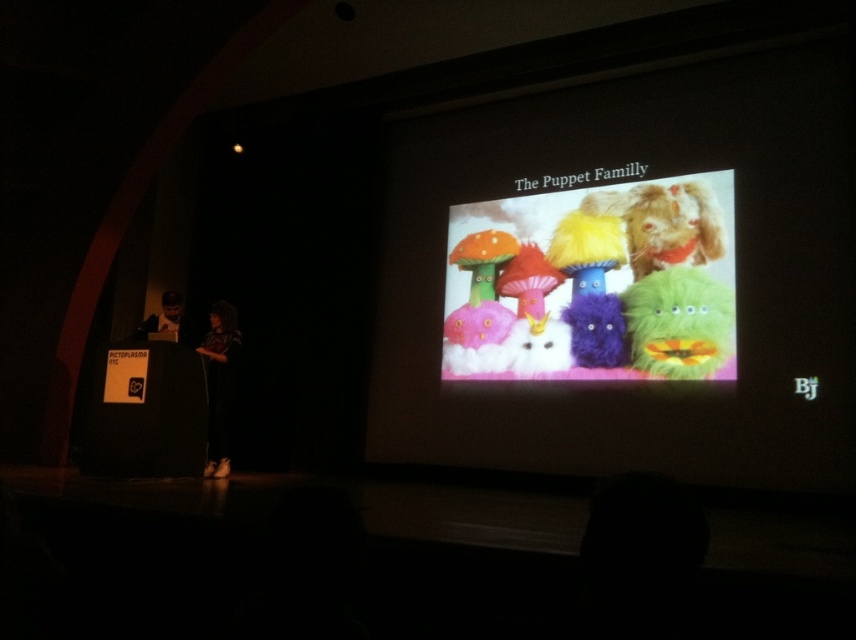
You are an attendee at the PICTORPLASMA NYC event and you see the fuzzy fabric puppets at center and the matte black clothing at center on the stage. Which object appears larger in size?

The fuzzy fabric puppets at center appears much taller than the matte black clothing at center, so it is the larger object.

You are an attendee at the PICTORPLASMA NYC event and you see the fuzzy fabric puppets at center and the fluffy brown dog at upper right on the screen. Which object appears larger on the screen?

The fuzzy fabric puppets at center appears larger than the fluffy brown dog at upper right on the screen.

You are an attendee at the PICTORPLASMA NYC event and you see the fuzzy fabric puppets at center and the matte black clothing at center on the stage. Which object is located to the right of the other?

The fuzzy fabric puppets at center is positioned on the right side of matte black clothing at center.